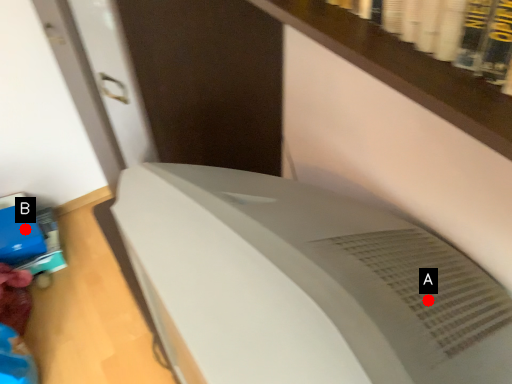
Question: Two points are circled on the image, labeled by A and B beside each circle. Which point is further to the camera?

Choices:
 (A) A is further
 (B) B is further

Answer: (B)